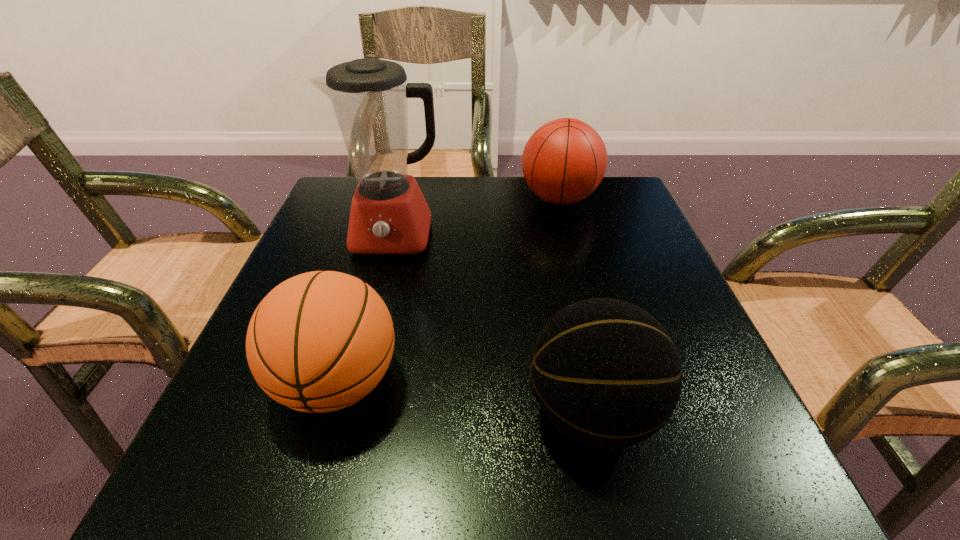
Find the location of a particular element. object that is at the far left corner is located at coordinates (389, 215).

This screenshot has height=540, width=960. What are the coordinates of `object positioned at the near left corner` in the screenshot? It's located at (320, 341).

Image resolution: width=960 pixels, height=540 pixels. In order to click on object that is at the far right corner in this screenshot , I will do `click(564, 161)`.

This screenshot has width=960, height=540. Identify the location of object present at the near right corner. (606, 373).

I want to click on free region at the far edge, so click(x=516, y=195).

The image size is (960, 540). Find the location of `vacant space at the near edge`. vacant space at the near edge is located at coordinates (427, 471).

Locate an element on the screen. The image size is (960, 540). free space at the left edge of the desktop is located at coordinates (354, 275).

This screenshot has width=960, height=540. What are the coordinates of `vacant region at the right edge of the desktop` in the screenshot? It's located at (591, 235).

The image size is (960, 540). In the image, there is a desktop. Identify the location of vacant space at the far left corner. (337, 192).

I want to click on vacant space at the far right corner of the desktop, so click(x=634, y=213).